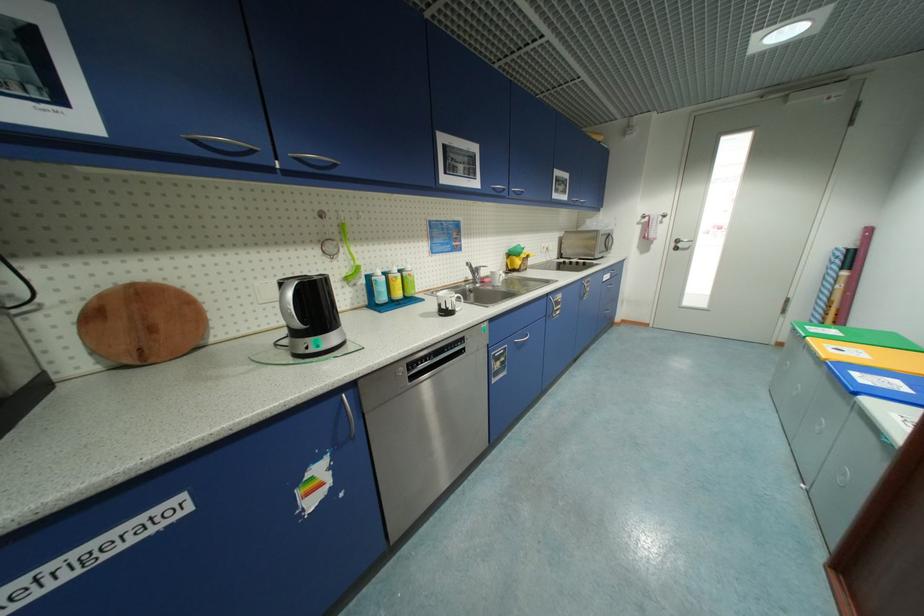
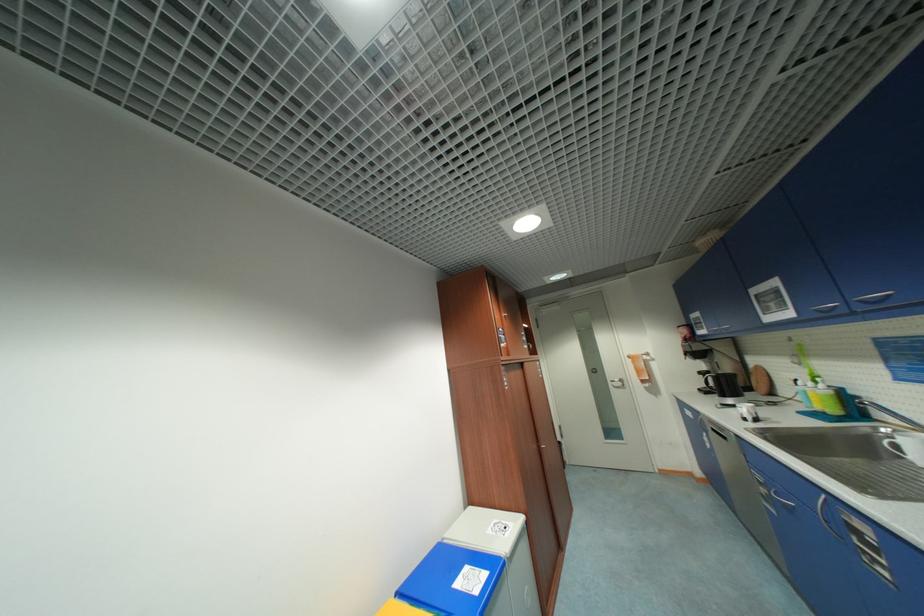
Where in the second image is the point corresponding to point (504, 365) from the first image?

(768, 491)